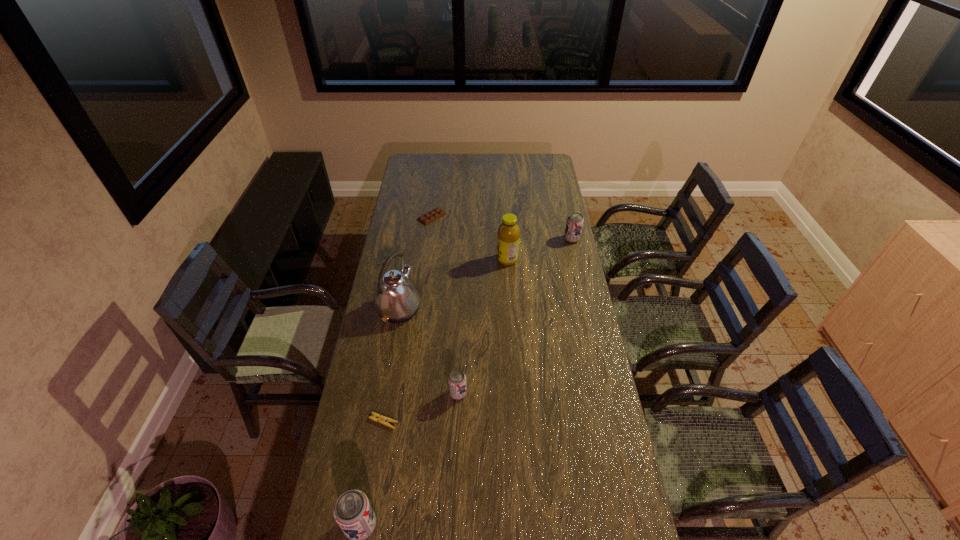
Please point a spot to place another beer_can for symmetrical spacing. Please provide its 2D coordinates. Your answer should be formatted as a tuple, i.e. [(x, y)], where the tuple contains the x and y coordinates of a point satisfying the conditions above.

[(524, 303)]